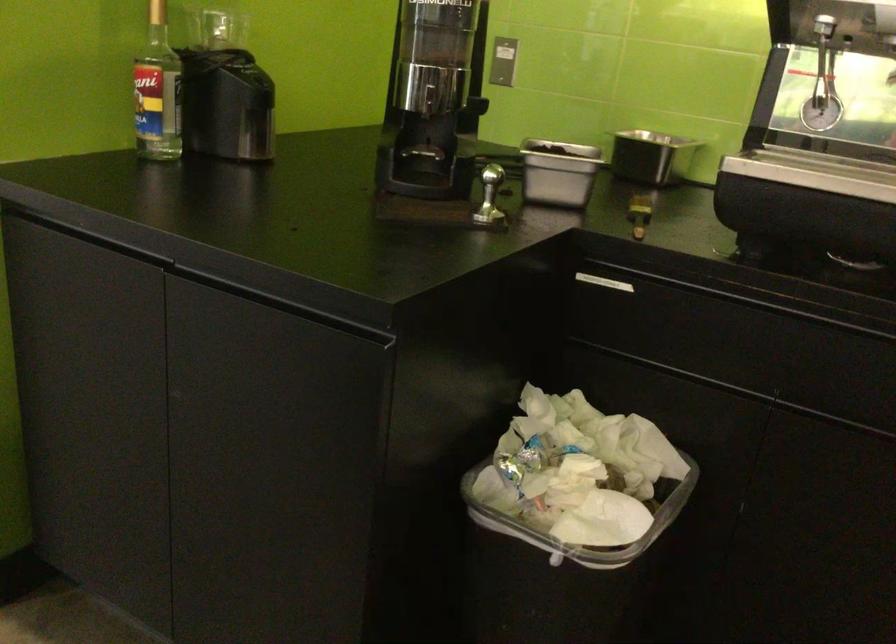
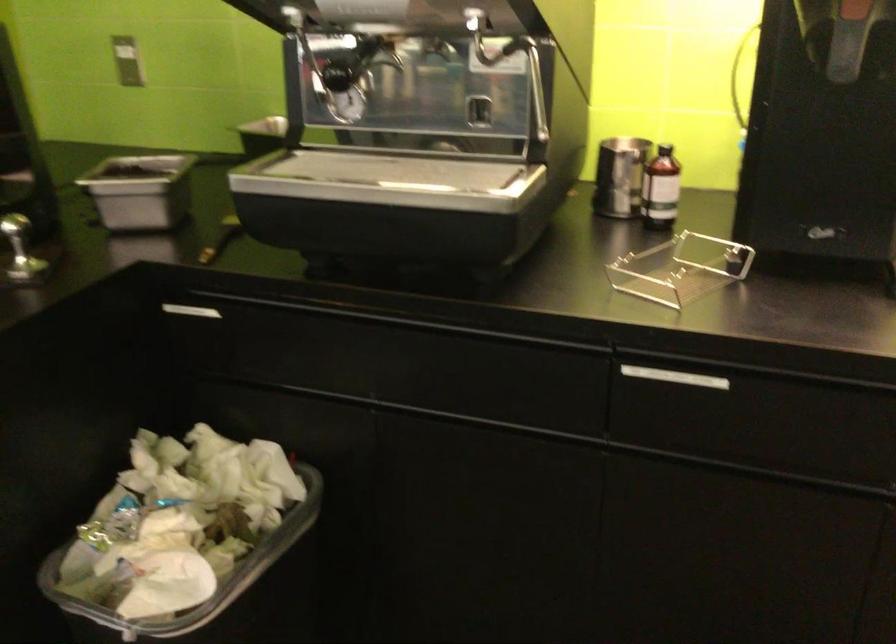
Where in the second image is the point corresponding to point (600, 281) from the first image?

(192, 310)